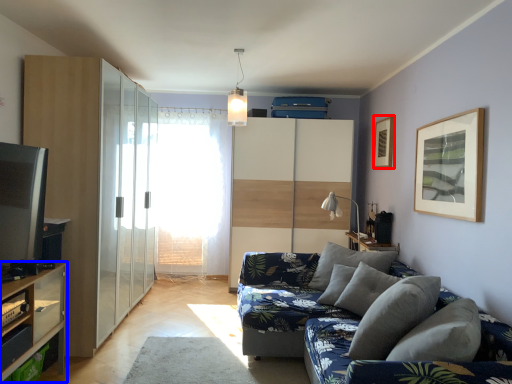
Question: Which of the following is the closest to the observer, picture frame (highlighted by a red box) or shelf (highlighted by a blue box)?

Choices:
 (A) picture frame
 (B) shelf

Answer: (B)